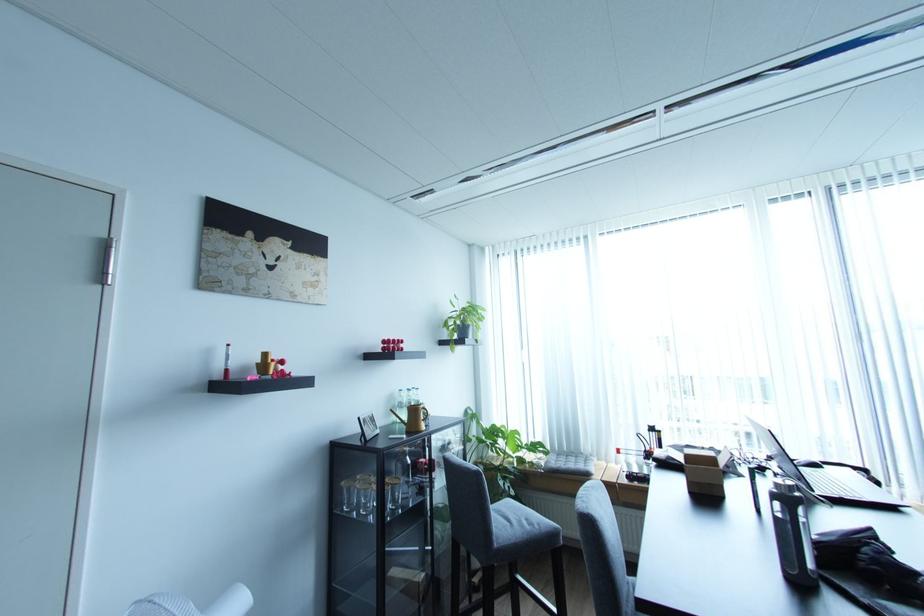
Image resolution: width=924 pixels, height=616 pixels. What are the coordinates of `red decorative object` in the screenshot? It's located at (392, 345).